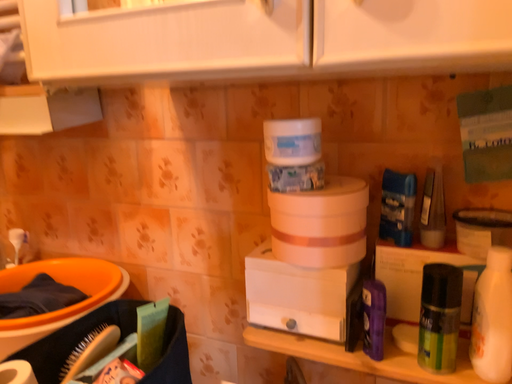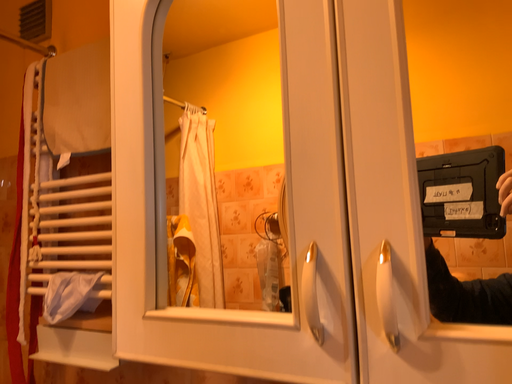
Question: How did the camera likely rotate when shooting the video?

Choices:
 (A) rotated downward
 (B) rotated upward

Answer: (B)